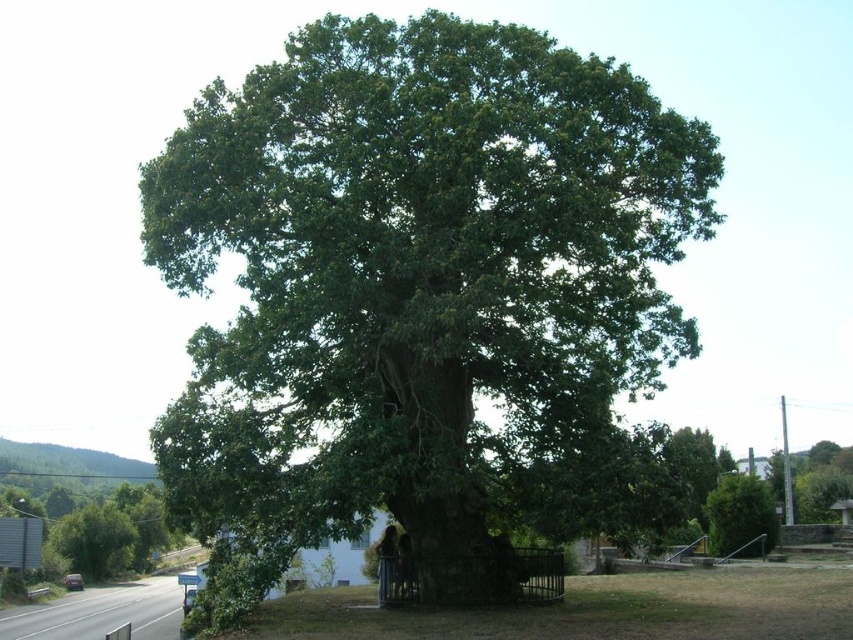
Question: Observing the image, what is the correct spatial positioning of green leafy oak tree at center in reference to green leafy tree at center?

Choices:
 (A) left
 (B) right

Answer: (A)

Question: Does green leafy oak tree at center appear on the right side of green leafy tree at center?

Choices:
 (A) no
 (B) yes

Answer: (A)

Question: Among these points, which one is farthest from the camera?

Choices:
 (A) (740, 490)
 (B) (614, 259)

Answer: (A)

Question: Can you confirm if green leafy oak tree at center is smaller than green leafy tree at center?

Choices:
 (A) no
 (B) yes

Answer: (A)